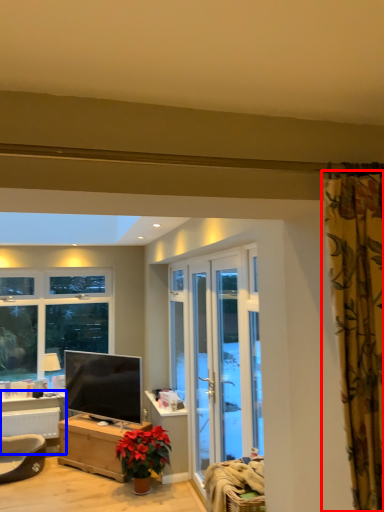
Question: Among these objects, which one is nearest to the camera, curtain (highlighted by a red box) or table (highlighted by a blue box)?

Choices:
 (A) curtain
 (B) table

Answer: (A)